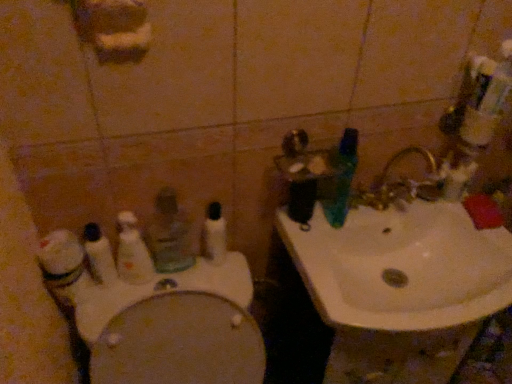
Where is `green plastic toothbrush at upper right, the 1th toothbrush when ordered from right to left`? Image resolution: width=512 pixels, height=384 pixels. green plastic toothbrush at upper right, the 1th toothbrush when ordered from right to left is located at coordinates (343, 179).

I want to click on white matte cleaning product at left, so click(62, 266).

What do you see at coordinates (132, 252) in the screenshot?
I see `white plastic toothbrush at left, arranged as the second toothbrush when viewed from the left` at bounding box center [132, 252].

The image size is (512, 384). What do you see at coordinates (99, 254) in the screenshot? I see `white plastic toothbrush at left, which is the first toothbrush in left-to-right order` at bounding box center [99, 254].

Measure the distance between white glossy toilet at lower left and camera.

The depth of white glossy toilet at lower left is 33.03 inches.

Where is `green plastic toothbrush at upper right, the 1th toothbrush when ordered from right to left`? green plastic toothbrush at upper right, the 1th toothbrush when ordered from right to left is located at coordinates (343, 179).

In the scene shown: From the image's perspective, which is above, green plastic toothbrush at upper right, the 1th toothbrush when ordered from right to left, or translucent plastic mouthwash at center?

green plastic toothbrush at upper right, the 1th toothbrush when ordered from right to left, from the image's perspective.

Is point (357, 160) closer or farther from the camera than point (167, 206)?

Point (357, 160) appears to be farther away from the viewer than point (167, 206).

Is green plastic toothbrush at upper right, the 1th toothbrush when ordered from right to left, in front of or behind translucent plastic mouthwash at center in the image?

green plastic toothbrush at upper right, the 1th toothbrush when ordered from right to left, is positioned closer to the viewer than translucent plastic mouthwash at center.

Can you tell me how much green plastic toothbrush at upper right, the 1th toothbrush when ordered from right to left, and translucent plastic mouthwash at center differ in facing direction?

There is a 5.02-degree angle between the facing directions of green plastic toothbrush at upper right, the 1th toothbrush when ordered from right to left, and translucent plastic mouthwash at center.

From a real-world perspective, is white plastic toothbrush at left, which appears as the fourth toothbrush when viewed from the right, located beneath white plastic toothbrush at center, which is the third toothbrush from left to right?

Yes, from a real-world perspective, white plastic toothbrush at left, which appears as the fourth toothbrush when viewed from the right, is below white plastic toothbrush at center, which is the third toothbrush from left to right.

Considering the positions of objects white plastic toothbrush at left, which appears as the fourth toothbrush when viewed from the right, and white plastic toothbrush at center, the second toothbrush in the right-to-left sequence, in the image provided, who is more to the left, white plastic toothbrush at left, which appears as the fourth toothbrush when viewed from the right, or white plastic toothbrush at center, the second toothbrush in the right-to-left sequence,?

white plastic toothbrush at left, which appears as the fourth toothbrush when viewed from the right.

Is white plastic toothbrush at left, which is the first toothbrush in left-to-right order, taller or shorter than white plastic toothbrush at center, the second toothbrush in the right-to-left sequence?

In the image, white plastic toothbrush at left, which is the first toothbrush in left-to-right order, appears to be taller than white plastic toothbrush at center, the second toothbrush in the right-to-left sequence.

Is white plastic toothbrush at center, the second toothbrush in the right-to-left sequence, inside green plastic toothbrush at upper right, which ranks as the 4th toothbrush in left-to-right order?

Definitely not — white plastic toothbrush at center, the second toothbrush in the right-to-left sequence, is not inside green plastic toothbrush at upper right, which ranks as the 4th toothbrush in left-to-right order.

From a real-world perspective, who is located higher, green plastic toothbrush at upper right, the 1th toothbrush when ordered from right to left, or white plastic toothbrush at center, the second toothbrush in the right-to-left sequence?

From a 3D spatial view, green plastic toothbrush at upper right, the 1th toothbrush when ordered from right to left, is above.

I want to click on the 2nd toothbrush above the white plastic toothbrush at center, which is the third toothbrush from left to right (from a real-world perspective), so click(343, 179).

Looking at this image, which is behind, green plastic toothbrush at upper right, the 1th toothbrush when ordered from right to left, or white plastic toothbrush at center, which is the third toothbrush from left to right?

white plastic toothbrush at center, which is the third toothbrush from left to right, is more distant.

Are white ceramic sink at upper right and translucent plastic mouthwash at center located far from each other?

That's not correct — white ceramic sink at upper right is a little close to translucent plastic mouthwash at center.

Between white ceramic sink at upper right and translucent plastic mouthwash at center, which one is positioned behind?

translucent plastic mouthwash at center is more distant.

From a real-world perspective, does white ceramic sink at upper right stand above translucent plastic mouthwash at center?

Actually, white ceramic sink at upper right is physically below translucent plastic mouthwash at center in the real world.

How far apart are white ceramic sink at upper right and translucent plastic mouthwash at center?

A distance of 17.49 inches exists between white ceramic sink at upper right and translucent plastic mouthwash at center.

In the scene shown: Is white plastic toothbrush at left, which is the first toothbrush in left-to-right order, positioned with its back to white plastic toothbrush at left, which is the 3th toothbrush from right to left?

That's not correct — white plastic toothbrush at left, which is the first toothbrush in left-to-right order, is not looking away from white plastic toothbrush at left, which is the 3th toothbrush from right to left.

Considering the relative sizes of white plastic toothbrush at left, which is the first toothbrush in left-to-right order, and white plastic toothbrush at left, arranged as the second toothbrush when viewed from the left, in the image provided, is white plastic toothbrush at left, which is the first toothbrush in left-to-right order, bigger than white plastic toothbrush at left, arranged as the second toothbrush when viewed from the left,?

Actually, white plastic toothbrush at left, which is the first toothbrush in left-to-right order, might be smaller than white plastic toothbrush at left, arranged as the second toothbrush when viewed from the left.

From the picture: From the image's perspective, is white plastic toothbrush at left, which appears as the fourth toothbrush when viewed from the right, above white plastic toothbrush at left, arranged as the second toothbrush when viewed from the left?

No.

Relative to white plastic toothbrush at left, which is the 3th toothbrush from right to left, is white plastic toothbrush at left, which is the first toothbrush in left-to-right order, in front or behind?

white plastic toothbrush at left, which is the first toothbrush in left-to-right order, is in front of white plastic toothbrush at left, which is the 3th toothbrush from right to left.

Visually, is white plastic toothbrush at left, which is the 3th toothbrush from right to left, positioned to the left or to the right of green plastic toothbrush at upper right, the 1th toothbrush when ordered from right to left?

Based on their positions, white plastic toothbrush at left, which is the 3th toothbrush from right to left, is located to the left of green plastic toothbrush at upper right, the 1th toothbrush when ordered from right to left.

Consider the image. From a real-world perspective, is white plastic toothbrush at left, which is the 3th toothbrush from right to left, on green plastic toothbrush at upper right, which ranks as the 4th toothbrush in left-to-right order?

No, from a real-world perspective, white plastic toothbrush at left, which is the 3th toothbrush from right to left, is not above green plastic toothbrush at upper right, which ranks as the 4th toothbrush in left-to-right order.

Between white plastic toothbrush at left, which is the 3th toothbrush from right to left, and green plastic toothbrush at upper right, which ranks as the 4th toothbrush in left-to-right order, which one has larger width?

green plastic toothbrush at upper right, which ranks as the 4th toothbrush in left-to-right order, is wider.

From the image's perspective, does white plastic toothbrush at left, which is the 3th toothbrush from right to left, appear lower than green plastic toothbrush at upper right, the 1th toothbrush when ordered from right to left?

Indeed, from the image's perspective, white plastic toothbrush at left, which is the 3th toothbrush from right to left, is shown beneath green plastic toothbrush at upper right, the 1th toothbrush when ordered from right to left.

Is white glossy toilet at lower left positioned behind white matte cleaning product at left?

No, white glossy toilet at lower left is closer to the camera.

Between white glossy toilet at lower left and white matte cleaning product at left, which one has less height?

white matte cleaning product at left is shorter.

This screenshot has height=384, width=512. I want to click on mouthwash that is behind the green plastic toothbrush at upper right, which ranks as the 4th toothbrush in left-to-right order, so click(x=169, y=235).

You are a GUI agent. You are given a task and a screenshot of the screen. Output one action in this format:
    pyautogui.click(x=<x>, y=<y>)
    Task: Click on the toothbrush that is the 2nd one when counting upward from the white plastic toothbrush at left, which appears as the fourth toothbrush when viewed from the right (from the image's perspective)
    The height and width of the screenshot is (384, 512).
    Given the screenshot: What is the action you would take?
    pyautogui.click(x=215, y=233)

When comparing their distances from white plastic toothbrush at center, the second toothbrush in the right-to-left sequence, does white matte cleaning product at left or white plastic toothbrush at left, which is the first toothbrush in left-to-right order, seem further?

white matte cleaning product at left is further to white plastic toothbrush at center, the second toothbrush in the right-to-left sequence.

When comparing their distances from white plastic toothbrush at left, which is the first toothbrush in left-to-right order, does green plastic toothbrush at upper right, which ranks as the 4th toothbrush in left-to-right order, or white plastic toothbrush at center, which is the third toothbrush from left to right, seem closer?

white plastic toothbrush at center, which is the third toothbrush from left to right, is positioned closer to the anchor white plastic toothbrush at left, which is the first toothbrush in left-to-right order.

Considering their positions, is white plastic toothbrush at left, which appears as the fourth toothbrush when viewed from the right, positioned closer to white matte cleaning product at left than white glossy toilet at lower left?

Based on the image, white plastic toothbrush at left, which appears as the fourth toothbrush when viewed from the right, appears to be nearer to white matte cleaning product at left.

Estimate the real-world distances between objects in this image. Which object is closer to green plastic toothbrush at upper right, which ranks as the 4th toothbrush in left-to-right order, translucent plastic mouthwash at center or white plastic toothbrush at left, which appears as the fourth toothbrush when viewed from the right?

translucent plastic mouthwash at center lies closer to green plastic toothbrush at upper right, which ranks as the 4th toothbrush in left-to-right order, than the other object.

Estimate the real-world distances between objects in this image. Which object is further from white ceramic sink at upper right, white plastic toothbrush at left, arranged as the second toothbrush when viewed from the left, or white glossy toilet at lower left?

white plastic toothbrush at left, arranged as the second toothbrush when viewed from the left, is further to white ceramic sink at upper right.

Considering their positions, is white matte cleaning product at left positioned further to translucent plastic mouthwash at center than white plastic toothbrush at left, which is the 3th toothbrush from right to left?

white matte cleaning product at left lies further to translucent plastic mouthwash at center than the other object.

Based on their spatial positions, is white matte cleaning product at left or green plastic toothbrush at upper right, which ranks as the 4th toothbrush in left-to-right order, closer to translucent plastic mouthwash at center?

The object closer to translucent plastic mouthwash at center is white matte cleaning product at left.

Estimate the real-world distances between objects in this image. Which object is closer to white plastic toothbrush at left, which is the 3th toothbrush from right to left, white plastic toothbrush at center, which is the third toothbrush from left to right, or white ceramic sink at upper right?

white plastic toothbrush at center, which is the third toothbrush from left to right.

The width and height of the screenshot is (512, 384). In order to click on sink between green plastic toothbrush at upper right, the 1th toothbrush when ordered from right to left, and white glossy toilet at lower left vertically in this screenshot , I will do `click(403, 266)`.

This screenshot has height=384, width=512. What are the coordinates of `mouthwash between green plastic toothbrush at upper right, which ranks as the 4th toothbrush in left-to-right order, and white glossy toilet at lower left vertically` in the screenshot? It's located at (169, 235).

Image resolution: width=512 pixels, height=384 pixels. I want to click on toilet located between white matte cleaning product at left and green plastic toothbrush at upper right, the 1th toothbrush when ordered from right to left, in the left-right direction, so click(174, 327).

Where is `toilet located between translucent plastic mouthwash at center and white ceramic sink at upper right in the left-right direction`? Image resolution: width=512 pixels, height=384 pixels. toilet located between translucent plastic mouthwash at center and white ceramic sink at upper right in the left-right direction is located at coordinates [174, 327].